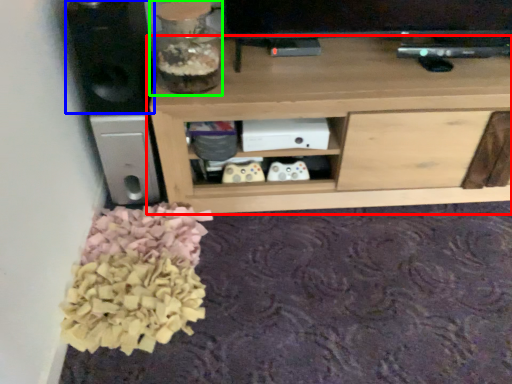
Question: Which object is positioned farthest from shelf (highlighted by a red box)? Select from speaker (highlighted by a blue box) and glass vase (highlighted by a green box).

Choices:
 (A) speaker
 (B) glass vase

Answer: (A)